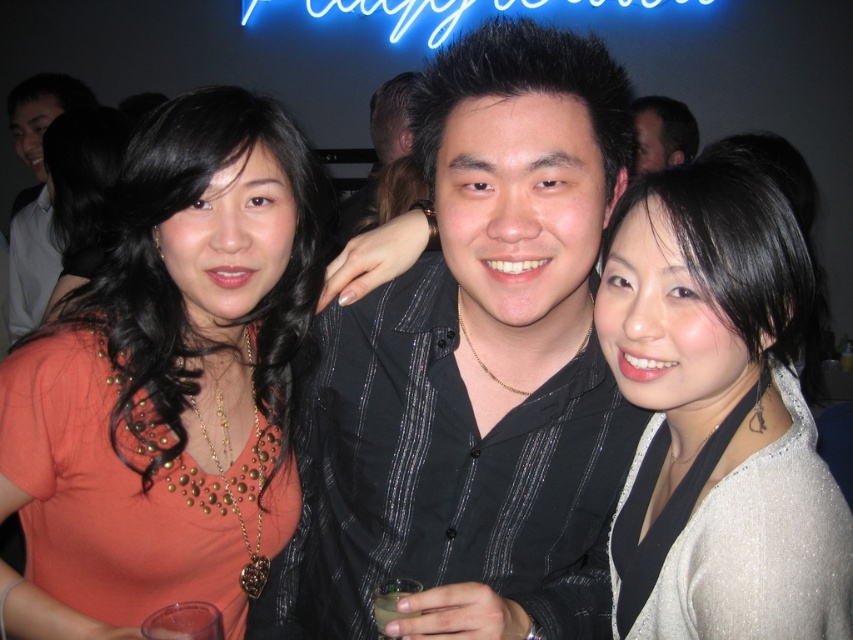
You are a photographer at the event and want to ensure all attendees are visible in the group photo. Given the current arrangement, will the person wearing the satin silver blouse at right be fully visible behind the matte black shirt at upper center?

The satin silver blouse at right is narrower than the matte black shirt at upper center, so it is likely that the person in the satin silver blouse at right will be at least partially obscured by the matte black shirt at upper center unless adjusted.

Looking at this image, what is the spatial relationship between the satin silver blouse at right and the other objects in the scene?

The satin silver blouse at right is located at coordinates point (x=718, y=416).